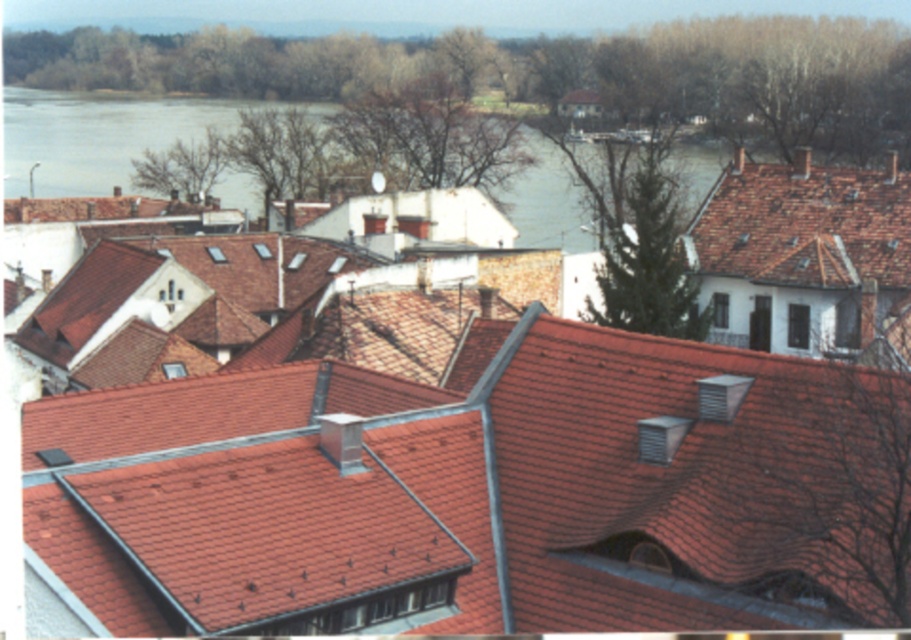
Based on the photo, you are standing at the point labeled as point (96, 136) in the image. Based on the scene description, what would you most likely see around you?

You would most likely see blue water at upper center around you as indicated by the point (96, 136).

What is the coordinate of the blue water at upper center?

The blue water at upper center is located at coordinate point (96, 136).